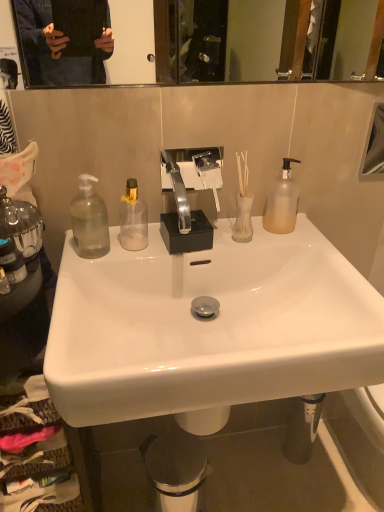
At what (x,y) coordinates should I click in order to perform the action: click on vacant point above metallic trash can at lower center (from a real-world perspective). Please return your answer as a coordinate pair (x, y). Looking at the image, I should click on (165, 458).